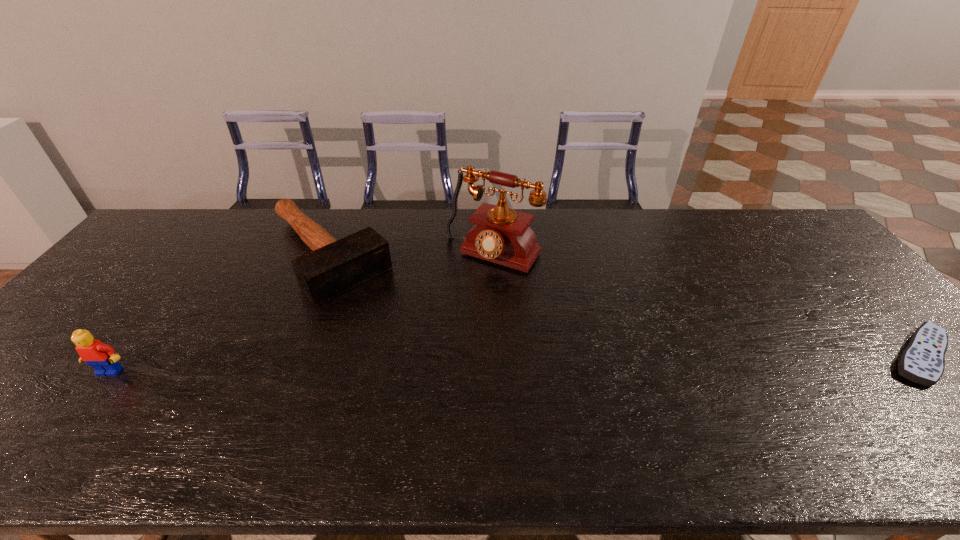
Where is `Lego`? This screenshot has width=960, height=540. Lego is located at coordinates click(x=101, y=357).

Identify the location of the second tallest object. (101, 357).

Identify the location of the tallest object. The image size is (960, 540). (501, 235).

Where is `telephone`? telephone is located at coordinates (501, 235).

The width and height of the screenshot is (960, 540). Identify the location of the second shortest object. (334, 267).

The height and width of the screenshot is (540, 960). What are the coordinates of `the third object from right to left` in the screenshot? It's located at (334, 267).

I want to click on vacant space located 0.050m on the face of the leftmost object, so click(92, 395).

Locate an element on the screen. This screenshot has height=540, width=960. vacant region located on the dial of the telephone is located at coordinates (429, 329).

Identify the location of free space located on the dial of the telephone. The width and height of the screenshot is (960, 540). (399, 367).

Locate an element on the screen. The height and width of the screenshot is (540, 960). vacant region located 0.170m on the dial of the telephone is located at coordinates (444, 309).